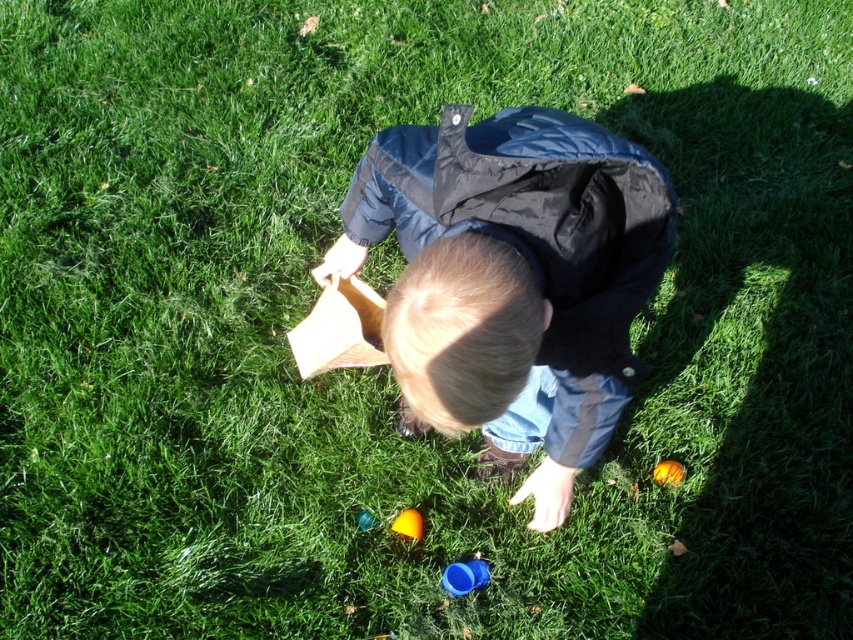
Is blue plastic cup at lower center taller than shiny yellow toy at center?

No, blue plastic cup at lower center is not taller than shiny yellow toy at center.

Is point (454, 579) positioned in front of point (404, 536)?

Yes, it is in front of point (404, 536).

Who is more distant from viewer, (450,593) or (415,529)?

Point (415,529)

Locate an element on the screen. blue plastic cup at lower center is located at coordinates (465, 577).

Can you confirm if shiny yellow toy at center is thinner than orange rubber ball at lower center?

No.

Can you confirm if shiny yellow toy at center is wider than orange rubber ball at lower center?

Yes.

This screenshot has height=640, width=853. Find the location of `shiny yellow toy at center`. shiny yellow toy at center is located at coordinates tap(408, 524).

Identify the location of shiny yellow toy at center. (408, 524).

Is point (486, 577) farther from camera compared to point (680, 476)?

No, (486, 577) is in front of (680, 476).

Does point (465, 579) come in front of point (676, 477)?

That is True.

Between point (456, 588) and point (669, 481), which one is positioned behind?

Positioned behind is point (669, 481).

You are a GUI agent. You are given a task and a screenshot of the screen. Output one action in this format:
    pyautogui.click(x=<x>, y=<y>)
    Task: Click on the blue plastic cup at lower center
    The height and width of the screenshot is (640, 853).
    Given the screenshot: What is the action you would take?
    pyautogui.click(x=465, y=577)